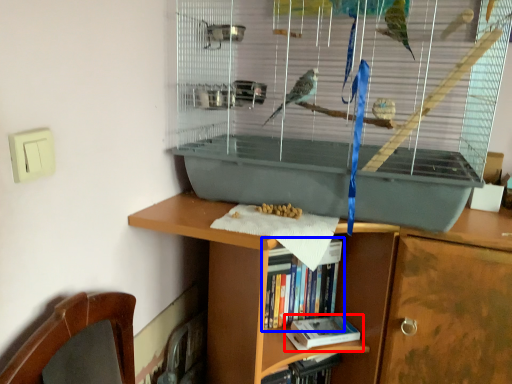
Question: Which object is further to the camera taking this photo, book (highlighted by a red box) or book (highlighted by a blue box)?

Choices:
 (A) book
 (B) book

Answer: (A)